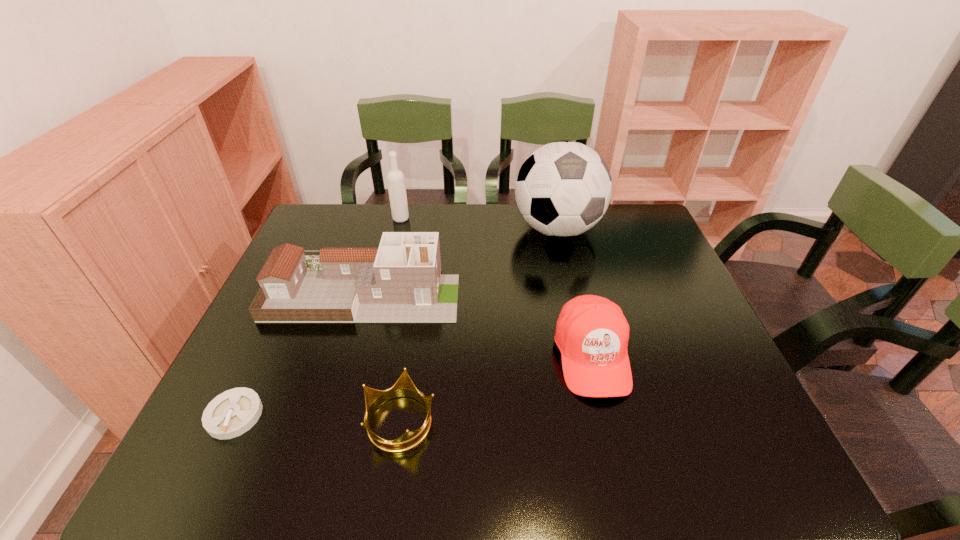
In the image, there is a desktop. At what (x,y) coordinates should I click in order to perform the action: click on free space at the near edge. Please return your answer as a coordinate pair (x, y). This screenshot has height=540, width=960. Looking at the image, I should click on (471, 465).

This screenshot has width=960, height=540. In the image, there is a desktop. Find the location of `free space at the right edge`. free space at the right edge is located at coordinates (679, 288).

Identify the location of vacant space at the far left corner of the desktop. Image resolution: width=960 pixels, height=540 pixels. (320, 239).

Find the location of `vacant space at the far right corner`. vacant space at the far right corner is located at coordinates (612, 239).

Locate an element on the screen. The width and height of the screenshot is (960, 540). vacant region between the second shortest object and the third shortest object is located at coordinates (496, 388).

Find the location of `free space between the fourth tallest object and the soccer ball`. free space between the fourth tallest object and the soccer ball is located at coordinates (575, 293).

I want to click on vacant point located between the third tallest object and the crown, so click(x=382, y=357).

At what (x,y) coordinates should I click in order to perform the action: click on free spot between the baseball cap and the third tallest object. Please return your answer as a coordinate pair (x, y). Image resolution: width=960 pixels, height=540 pixels. Looking at the image, I should click on (477, 325).

The height and width of the screenshot is (540, 960). What are the coordinates of `free point between the soccer ball and the fourth tallest object` in the screenshot? It's located at (575, 293).

The width and height of the screenshot is (960, 540). Find the location of `free space between the vodka and the baseball cap`. free space between the vodka and the baseball cap is located at coordinates (496, 287).